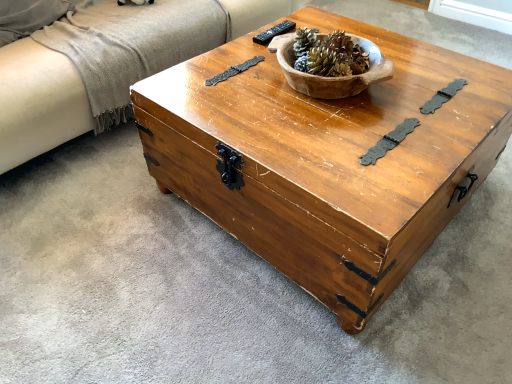
Question: Would you say beige fabric couch at left is to the left or to the right of black plastic remote at upper center in the picture?

Choices:
 (A) right
 (B) left

Answer: (B)

Question: Is point (70, 76) positioned closer to the camera than point (257, 36)?

Choices:
 (A) closer
 (B) farther

Answer: (A)

Question: Which object is the farthest from the wooden bowl at center?

Choices:
 (A) black plastic remote at upper center
 (B) beige fabric couch at left
 (C) wooden chest at center

Answer: (B)

Question: Based on their relative distances, which object is nearer to the black plastic remote at upper center?

Choices:
 (A) wooden chest at center
 (B) wooden bowl at center
 (C) beige fabric couch at left

Answer: (B)